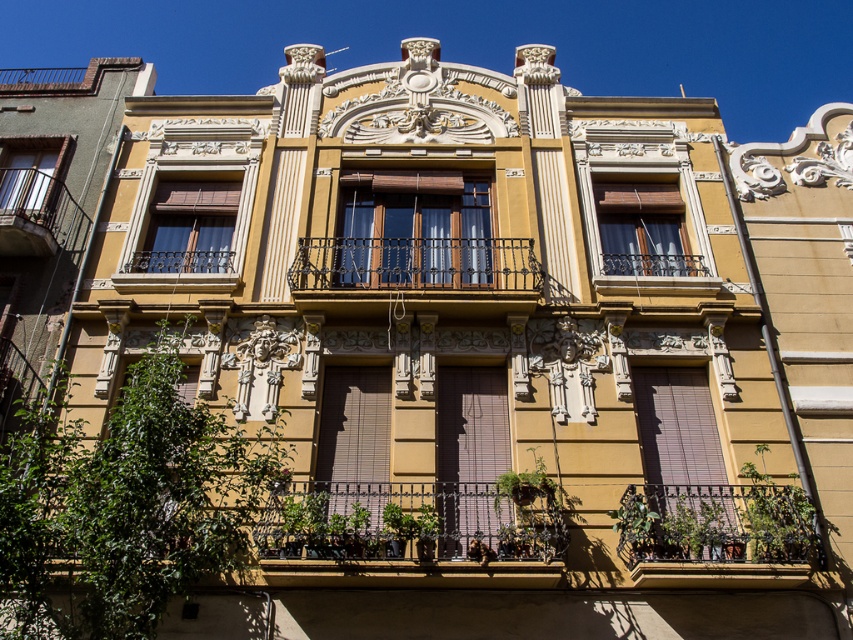
Does point (614, 259) lie behind point (44, 198)?

No, it is in front of (44, 198).

Does wooden/textured window at upper center appear over matte white curtain at left?

No.

Between point (608, 234) and point (51, 156), which one is positioned in front?

Point (608, 234) is in front.

I want to click on wooden/textured window at upper center, so click(642, 228).

Can you confirm if matte white curtain at left is smaller than metallic wrought iron balcony at left?

Yes.

Does matte white curtain at left have a lesser height compared to metallic wrought iron balcony at left?

Yes, matte white curtain at left is shorter than metallic wrought iron balcony at left.

Which is behind, point (48, 157) or point (39, 240)?

Point (48, 157)

The width and height of the screenshot is (853, 640). What are the coordinates of `matte white curtain at left` in the screenshot? It's located at (30, 184).

Does ironwork balcony at center have a lesser height compared to wooden/textured window at upper center?

No, ironwork balcony at center is not shorter than wooden/textured window at upper center.

Who is more distant from viewer, (415, 246) or (619, 259)?

Point (619, 259)

This screenshot has width=853, height=640. Describe the element at coordinates (415, 264) in the screenshot. I see `ironwork balcony at center` at that location.

I want to click on ironwork balcony at center, so (x=415, y=264).